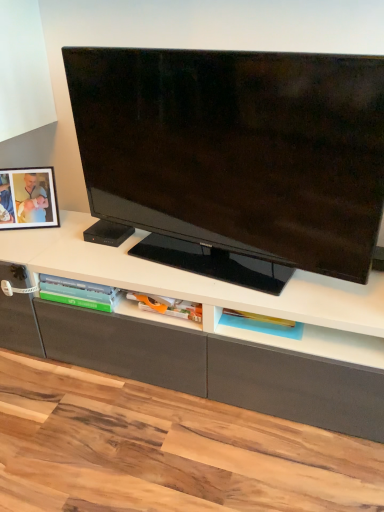
Question: Is matte black tv at center located within translucent plastic tray at lower center?

Choices:
 (A) yes
 (B) no

Answer: (B)

Question: Can you confirm if translucent plastic tray at lower center is wider than matte black tv at center?

Choices:
 (A) yes
 (B) no

Answer: (A)

Question: From a real-world perspective, does translucent plastic tray at lower center stand above matte black tv at center?

Choices:
 (A) yes
 (B) no

Answer: (B)

Question: Is translucent plastic tray at lower center completely or partially outside of matte black tv at center?

Choices:
 (A) yes
 (B) no

Answer: (A)

Question: Does translucent plastic tray at lower center turn towards matte black tv at center?

Choices:
 (A) no
 (B) yes

Answer: (A)

Question: From the image's perspective, is matte black tv at center positioned above or below matte black picture frame at left?

Choices:
 (A) below
 (B) above

Answer: (B)

Question: From a real-world perspective, is matte black tv at center physically located above or below matte black picture frame at left?

Choices:
 (A) above
 (B) below

Answer: (A)

Question: Relative to matte black picture frame at left, is matte black tv at center in front or behind?

Choices:
 (A) front
 (B) behind

Answer: (A)

Question: In terms of height, does matte black tv at center look taller or shorter compared to matte black picture frame at left?

Choices:
 (A) tall
 (B) short

Answer: (A)

Question: Considering the positions of point tap(139, 178) and point tap(276, 331), is point tap(139, 178) closer or farther from the camera than point tap(276, 331)?

Choices:
 (A) closer
 (B) farther

Answer: (B)

Question: Relative to translucent plastic tray at lower center, is matte black tv at center in front or behind?

Choices:
 (A) front
 (B) behind

Answer: (A)

Question: In the image, is matte black tv at center on the left side or the right side of translucent plastic tray at lower center?

Choices:
 (A) left
 (B) right

Answer: (A)

Question: Considering the positions of matte black tv at center and translucent plastic tray at lower center in the image, is matte black tv at center wider or thinner than translucent plastic tray at lower center?

Choices:
 (A) thin
 (B) wide

Answer: (A)

Question: Looking at the image, does matte black picture frame at left seem bigger or smaller compared to translucent plastic tray at lower center?

Choices:
 (A) big
 (B) small

Answer: (A)

Question: Is matte black picture frame at left spatially inside translucent plastic tray at lower center, or outside of it?

Choices:
 (A) inside
 (B) outside

Answer: (B)